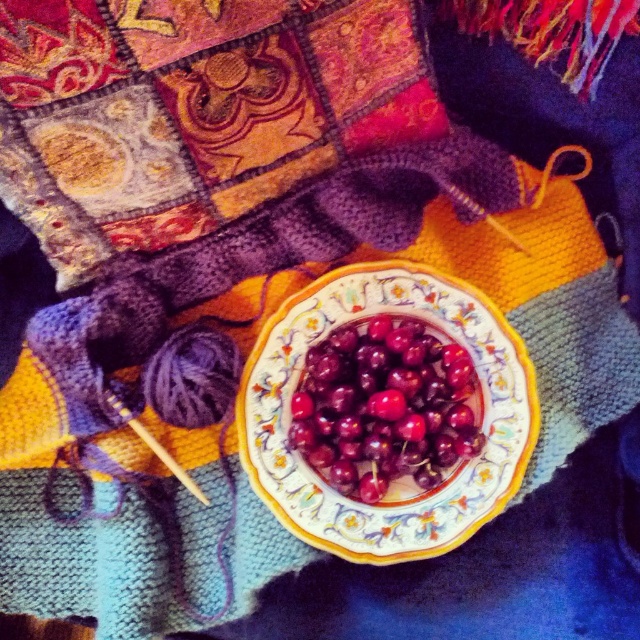
Question: Can you confirm if porcelain plate at center is positioned to the left of shiny red cherries at center?

Choices:
 (A) yes
 (B) no

Answer: (B)

Question: Observing the image, what is the correct spatial positioning of porcelain plate at center in reference to shiny red cherries at center?

Choices:
 (A) left
 (B) right

Answer: (B)

Question: Which object is closer to the camera taking this photo?

Choices:
 (A) porcelain plate at center
 (B) shiny red cherries at center

Answer: (B)

Question: Is porcelain plate at center to the left of shiny red cherries at center from the viewer's perspective?

Choices:
 (A) no
 (B) yes

Answer: (A)

Question: Which point is closer to the camera?

Choices:
 (A) (275, 324)
 (B) (420, 384)

Answer: (B)